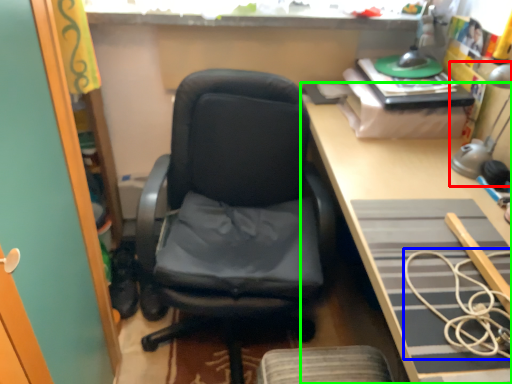
Question: Considering the real-world distances, which object is farthest from table lamp (highlighted by a red box)? rope (highlighted by a blue box) or desk (highlighted by a green box)?

Choices:
 (A) rope
 (B) desk

Answer: (A)